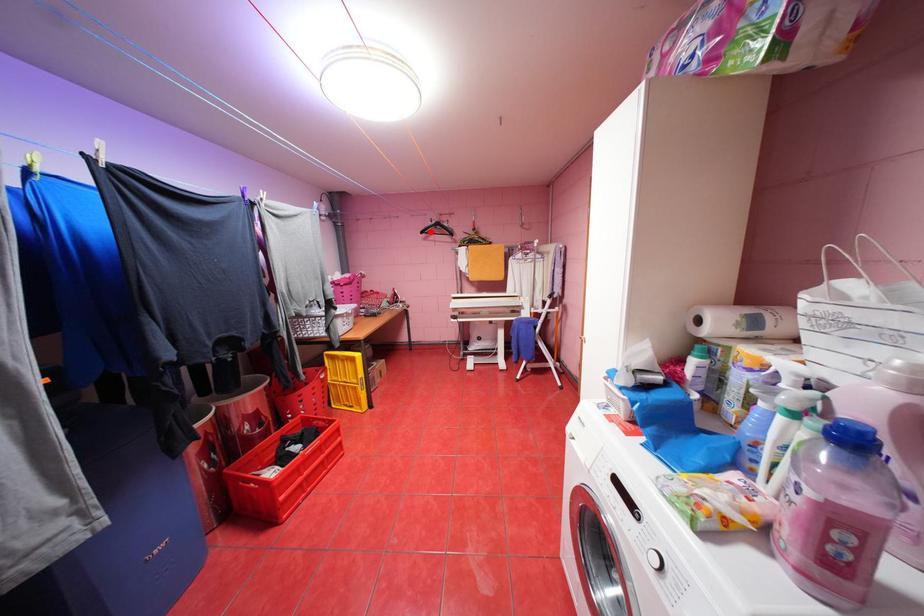
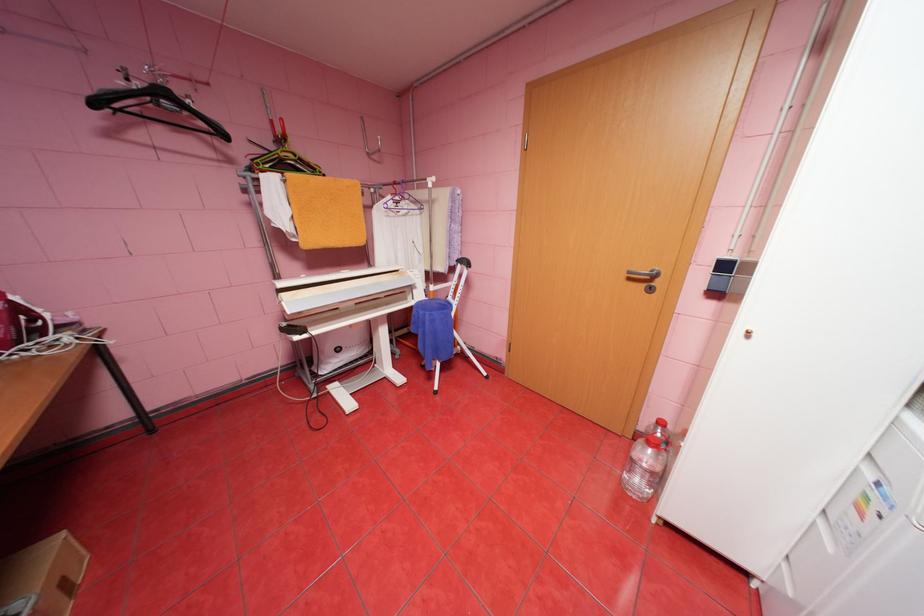
Question: A red point is marked in image1. In image2, is the corresponding 3D point closer to the camera or farther? Reply with the corresponding letter.

Choices:
 (A) The corresponding 3D point is closer.
 (B) The corresponding 3D point is farther.

Answer: (B)